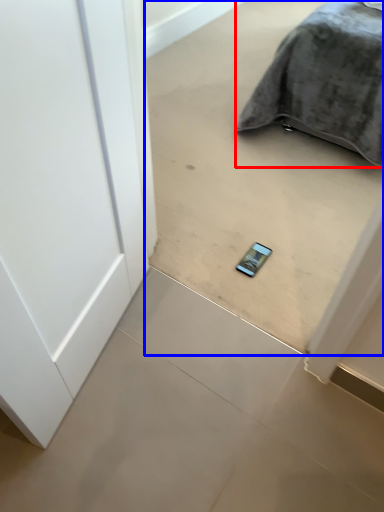
Question: Which point is closer to the camera, furniture (highlighted by a red box) or concrete (highlighted by a blue box)?

Choices:
 (A) furniture
 (B) concrete

Answer: (B)